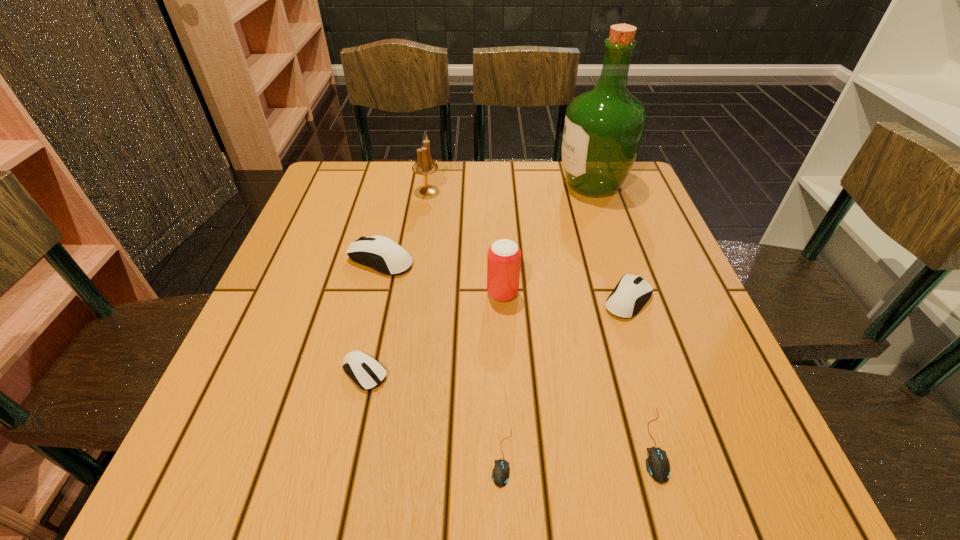
You are a GUI agent. You are given a task and a screenshot of the screen. Output one action in this format:
    pyautogui.click(x=<x>, y=<y>)
    Task: Click on the unoccupied position between the liquor and the third mouse from left to right
    This screenshot has width=960, height=540.
    Given the screenshot: What is the action you would take?
    pyautogui.click(x=547, y=321)

The image size is (960, 540). Find the location of `empty space that is in between the beer can and the third shortest object`. empty space that is in between the beer can and the third shortest object is located at coordinates (434, 333).

Find the location of a particular element. The image size is (960, 540). free point between the rightmost white mouse and the second shortest mouse is located at coordinates coord(641,372).

Identify the location of unoccupied position between the beer can and the right black mouse. (578, 369).

Image resolution: width=960 pixels, height=540 pixels. Find the location of `empty location between the fourth shortest object and the red beer can`. empty location between the fourth shortest object and the red beer can is located at coordinates (565, 296).

Find the location of a particular element. The width and height of the screenshot is (960, 540). the closest object to the second tallest object is located at coordinates (380, 253).

This screenshot has width=960, height=540. What are the coordinates of `object that stands as the second closest to the second shortest object` in the screenshot? It's located at click(500, 474).

Locate an element on the screen. This screenshot has width=960, height=540. mouse that can be found as the second closest to the second farthest mouse is located at coordinates (500, 474).

Locate which mouse is the second closest to the third nearest object. Please provide its 2D coordinates. Your answer should be formatted as a tuple, i.e. [(x, y)], where the tuple contains the x and y coordinates of a point satisfying the conditions above.

[(380, 253)]

Select which white mouse is the third closest to the liquor. Please provide its 2D coordinates. Your answer should be formatted as a tuple, i.e. [(x, y)], where the tuple contains the x and y coordinates of a point satisfying the conditions above.

[(367, 373)]